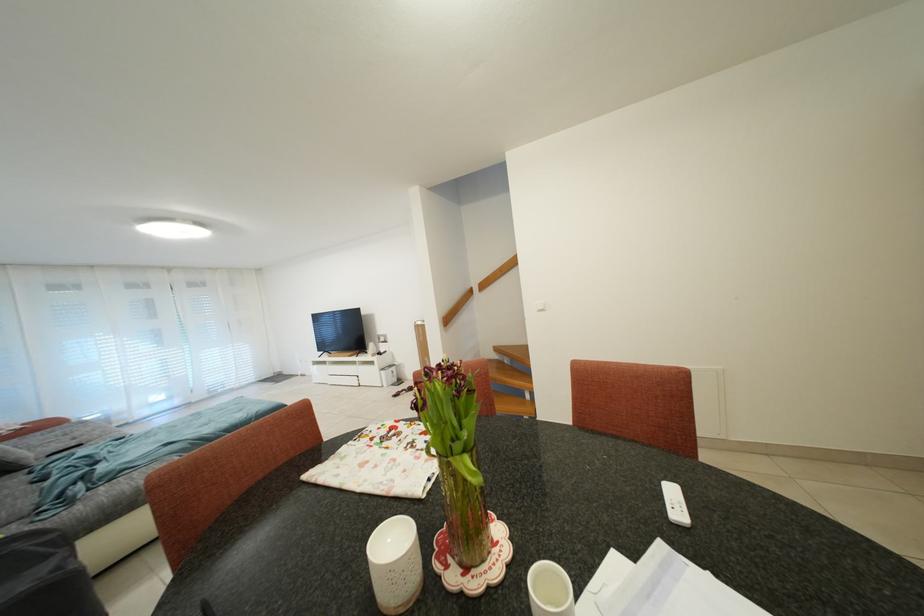
Where would you sit the sofa sitting surface? Please return your answer as a coordinate pair (x, y).

(52, 444)